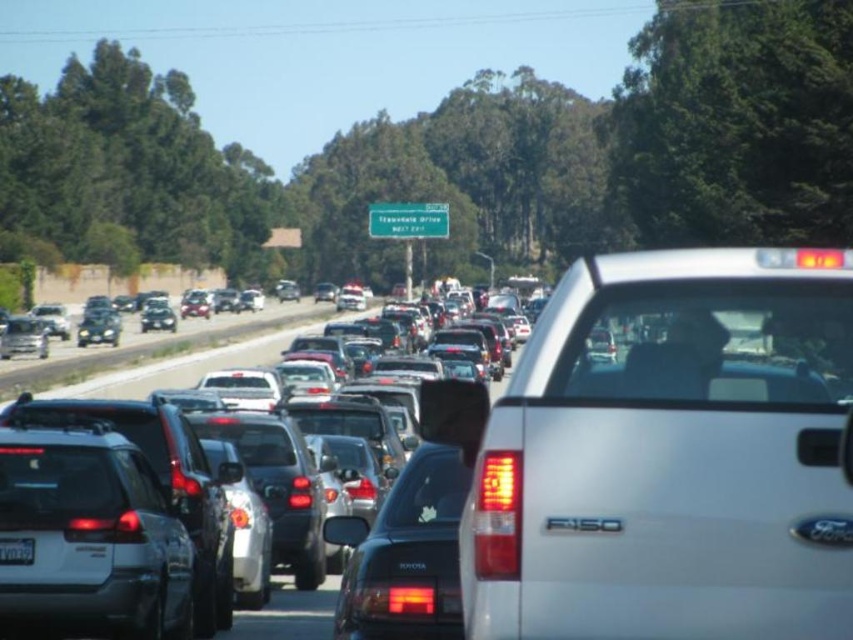
You are a GUI agent. You are given a task and a screenshot of the screen. Output one action in this format:
    pyautogui.click(x=<x>, y=<y>)
    Task: Click on the matte black suv at center
    
    Given the screenshot: What is the action you would take?
    pyautogui.click(x=189, y=365)

Can you confirm if matte black suv at center is positioned to the right of metallic silver cars at center?

Indeed, matte black suv at center is positioned on the right side of metallic silver cars at center.

This screenshot has height=640, width=853. I want to click on matte black suv at center, so click(189, 365).

Find the location of a particular element. The height and width of the screenshot is (640, 853). matte black suv at center is located at coordinates (189, 365).

Is white matte truck at center below matte black suv at center?

Incorrect, white matte truck at center is not positioned below matte black suv at center.

Is point (708, 292) positioned behind point (506, 371)?

No, it is not.

Who is more forward, (761, 476) or (267, 346)?

Point (761, 476) is in front.

Locate an element on the screen. This screenshot has width=853, height=640. white matte truck at center is located at coordinates click(x=670, y=456).

Does white matte truck at center appear over metallic silver cars at center?

Yes.

Is white matte truck at center closer to camera compared to metallic silver cars at center?

That is True.

The width and height of the screenshot is (853, 640). I want to click on white matte truck at center, so click(x=670, y=456).

Locate an element on the screen. The image size is (853, 640). white matte truck at center is located at coordinates (670, 456).